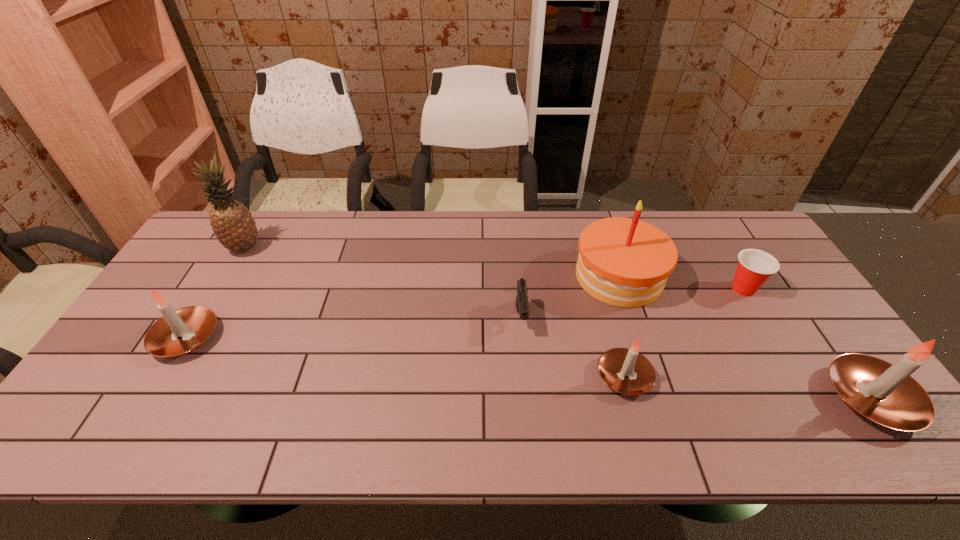
Identify the location of pineapple situated at the left edge. (232, 222).

I want to click on candle located in the right edge section of the desktop, so click(884, 393).

This screenshot has width=960, height=540. Identify the location of cup that is at the right edge. (755, 266).

Identify the location of object that is at the far left corner. The height and width of the screenshot is (540, 960). (232, 222).

The width and height of the screenshot is (960, 540). What are the coordinates of `object at the near right corner` in the screenshot? It's located at (884, 393).

Where is `free space at the far edge of the desktop`? Image resolution: width=960 pixels, height=540 pixels. free space at the far edge of the desktop is located at coordinates (651, 216).

The width and height of the screenshot is (960, 540). I want to click on vacant area at the near edge of the desktop, so click(x=653, y=399).

At what (x,y) coordinates should I click in order to perform the action: click on vacant space at the right edge. Please return your answer as a coordinate pair (x, y). Looking at the image, I should click on (805, 361).

Locate an element on the screen. free space that is in between the second shortest candle and the cup is located at coordinates (465, 313).

This screenshot has height=540, width=960. I want to click on free area in between the second candle from right to left and the leftmost candle, so click(x=405, y=357).